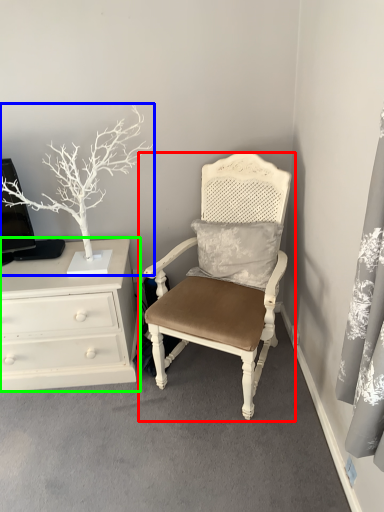
Question: Which is farther away from chair (highlighted by a red box)? houseplant (highlighted by a blue box) or chest of drawers (highlighted by a green box)?

Choices:
 (A) houseplant
 (B) chest of drawers

Answer: (A)